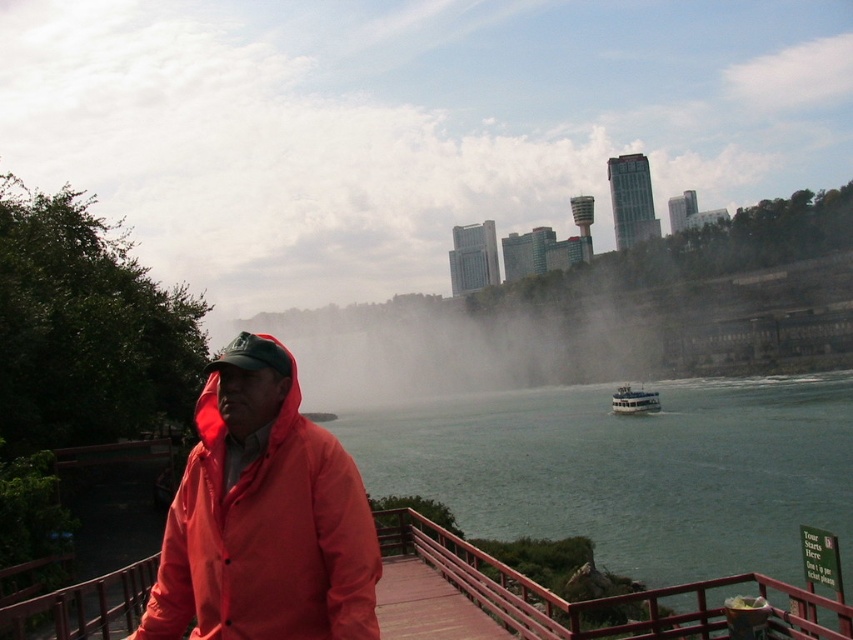
Question: Does matte red jacket at center appear over white glossy boat at lower center?

Choices:
 (A) no
 (B) yes

Answer: (B)

Question: Which point is closer to the camera taking this photo?

Choices:
 (A) (613, 397)
 (B) (171, 576)
 (C) (763, 404)

Answer: (B)

Question: Which point is closer to the camera?

Choices:
 (A) (630, 506)
 (B) (630, 413)

Answer: (A)

Question: Is green water at center below white glossy boat at lower center?

Choices:
 (A) no
 (B) yes

Answer: (B)

Question: Does green water at center come in front of matte red jacket at center?

Choices:
 (A) yes
 (B) no

Answer: (B)

Question: Which object is positioned farthest from the matte red jacket at center?

Choices:
 (A) green water at center
 (B) white glossy boat at lower center

Answer: (B)